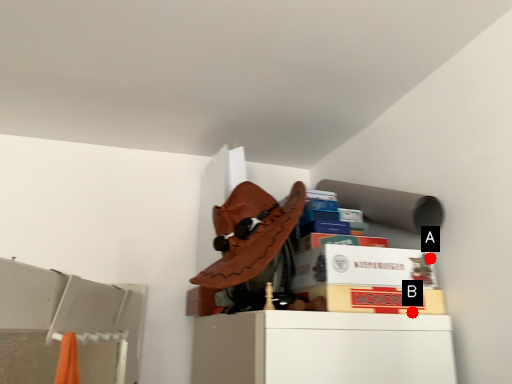
Question: Two points are circled on the image, labeled by A and B beside each circle. Which point is closer to the camera taking this photo?

Choices:
 (A) A is closer
 (B) B is closer

Answer: (B)